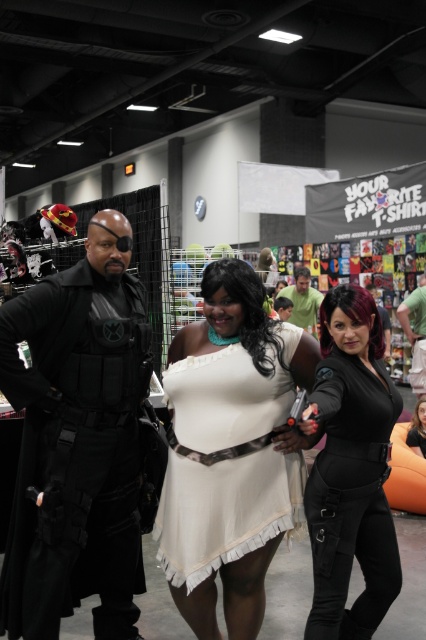
You are a photographer at the event and want to capture both the matte black bodysuit at center and the matte black dress at center in a single photo. Which one should you focus on first to ensure both are in frame?

The matte black bodysuit at center is located above the matte black dress at center, so you should focus on the matte black bodysuit at center first to ensure both are in frame.

You are a photographer at the event and want to take a photo focusing on the white satin dress at center and the black leather vest at center. Which one will appear larger in the photo?

The white satin dress at center will appear larger in the photo because it is closer to the viewer than the black leather vest at center.